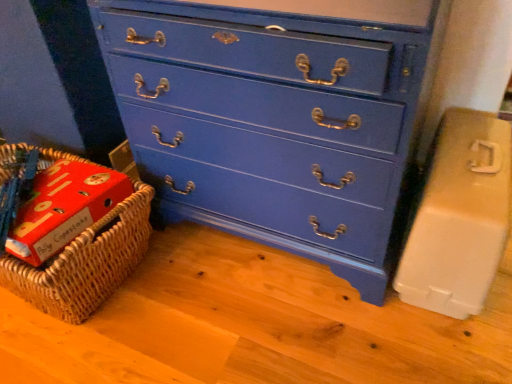
Question: Is beige plastic container at right to the left of woven brown basket at lower left from the viewer's perspective?

Choices:
 (A) yes
 (B) no

Answer: (B)

Question: From the image's perspective, is beige plastic container at right located beneath woven brown basket at lower left?

Choices:
 (A) no
 (B) yes

Answer: (A)

Question: Is beige plastic container at right not inside woven brown basket at lower left?

Choices:
 (A) no
 (B) yes

Answer: (B)

Question: From a real-world perspective, is beige plastic container at right positioned over woven brown basket at lower left based on gravity?

Choices:
 (A) no
 (B) yes

Answer: (B)

Question: Would you say woven brown basket at lower left is part of beige plastic container at right's contents?

Choices:
 (A) no
 (B) yes

Answer: (A)

Question: Is beige plastic container at right taller or shorter than blue painted wood chest of drawers at center?

Choices:
 (A) tall
 (B) short

Answer: (B)

Question: Based on their positions, is beige plastic container at right located to the left or right of blue painted wood chest of drawers at center?

Choices:
 (A) right
 (B) left

Answer: (A)

Question: Considering their positions, is beige plastic container at right located in front of or behind blue painted wood chest of drawers at center?

Choices:
 (A) front
 (B) behind

Answer: (B)

Question: From a real-world perspective, is beige plastic container at right positioned above or below blue painted wood chest of drawers at center?

Choices:
 (A) below
 (B) above

Answer: (A)

Question: Is beige plastic container at right situated inside woven brown basket at lower left or outside?

Choices:
 (A) inside
 (B) outside

Answer: (B)

Question: Is point (450, 109) positioned closer to the camera than point (53, 301)?

Choices:
 (A) farther
 (B) closer

Answer: (A)

Question: From their relative heights in the image, would you say beige plastic container at right is taller or shorter than woven brown basket at lower left?

Choices:
 (A) short
 (B) tall

Answer: (B)

Question: From a real-world perspective, is beige plastic container at right above or below woven brown basket at lower left?

Choices:
 (A) below
 (B) above

Answer: (B)

Question: Is woven brown basket at lower left in front of or behind beige plastic container at right in the image?

Choices:
 (A) front
 (B) behind

Answer: (B)

Question: Is woven brown basket at lower left to the left or to the right of beige plastic container at right in the image?

Choices:
 (A) right
 (B) left

Answer: (B)